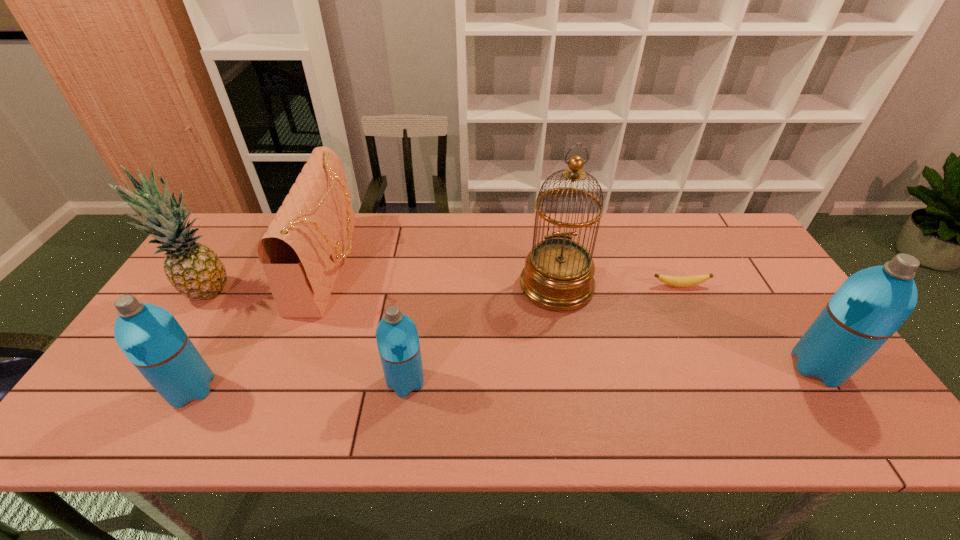
Where is `free space that satisfies the following two spatial constraints: 1. on the front-facing side of the third object from left to right; 2. on the left side of the second thermos bottle from right to left`? This screenshot has height=540, width=960. free space that satisfies the following two spatial constraints: 1. on the front-facing side of the third object from left to right; 2. on the left side of the second thermos bottle from right to left is located at coordinates (286, 381).

This screenshot has width=960, height=540. I want to click on vacant region that satisfies the following two spatial constraints: 1. on the back side of the fourth object from right to left; 2. on the left side of the banana, so click(x=420, y=286).

Find the location of a particular element. vacant space that satisfies the following two spatial constraints: 1. on the front-facing side of the third object from left to right; 2. on the right side of the shortest thermos bottle is located at coordinates (286, 381).

Where is `free region that satisfies the following two spatial constraints: 1. on the back side of the banana; 2. on the left side of the pineapple`? This screenshot has width=960, height=540. free region that satisfies the following two spatial constraints: 1. on the back side of the banana; 2. on the left side of the pineapple is located at coordinates click(209, 286).

This screenshot has height=540, width=960. What are the coordinates of `vacant space that satisfies the following two spatial constraints: 1. on the front-facing side of the handbag; 2. on the right side of the second thermos bottle from right to left` in the screenshot? It's located at (286, 381).